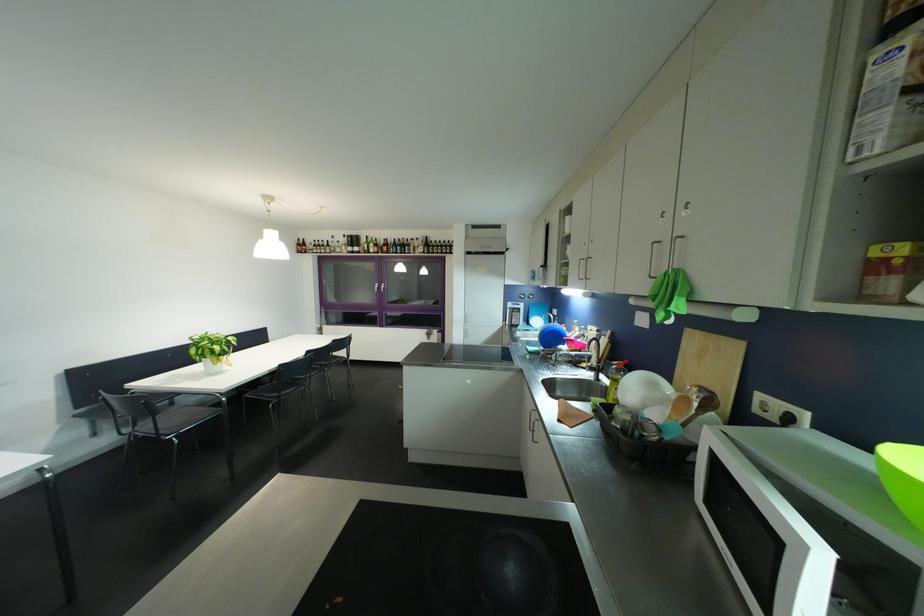
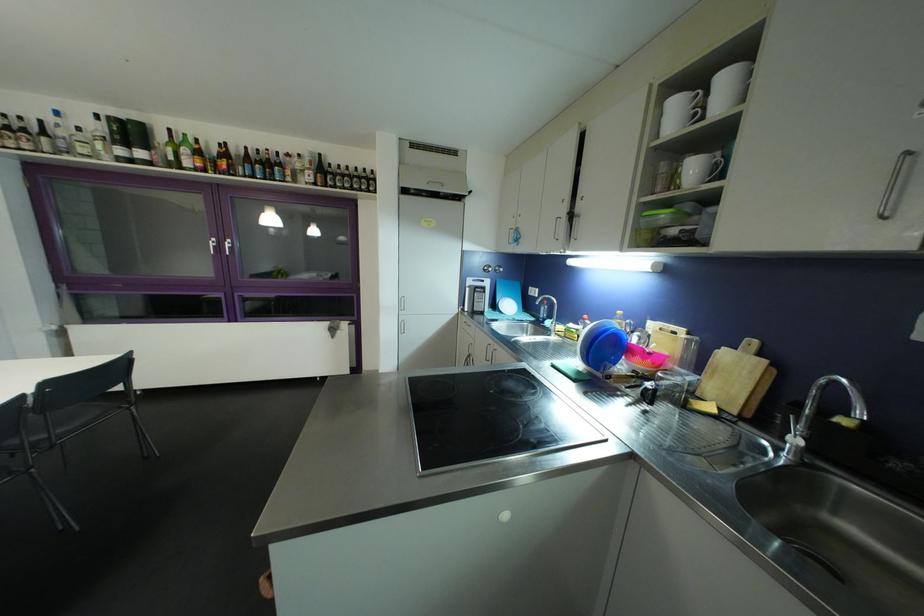
Find the pixel in the second image that matches point (347, 246) in the first image.

(94, 137)